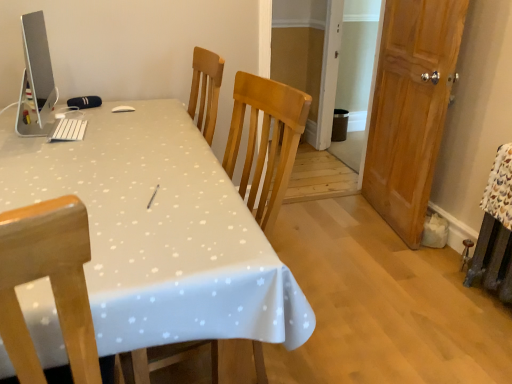
You are a GUI agent. You are given a task and a screenshot of the screen. Output one action in this format:
    pyautogui.click(x=<x>, y=<y>)
    Task: Click on the vacant space underneath sleek silver monitor at upper left (from a real-world perspective)
    
    Given the screenshot: What is the action you would take?
    pyautogui.click(x=38, y=134)